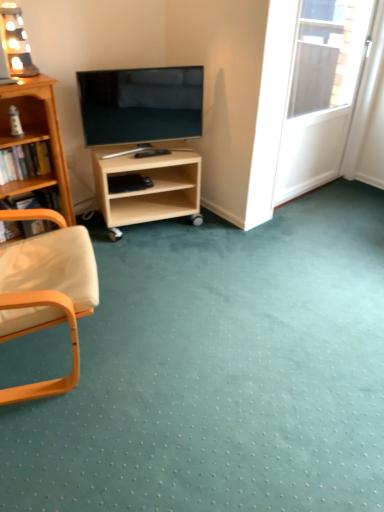
Locate an element on the screen. vacant region to the right of white glossy screen door at upper right is located at coordinates (355, 197).